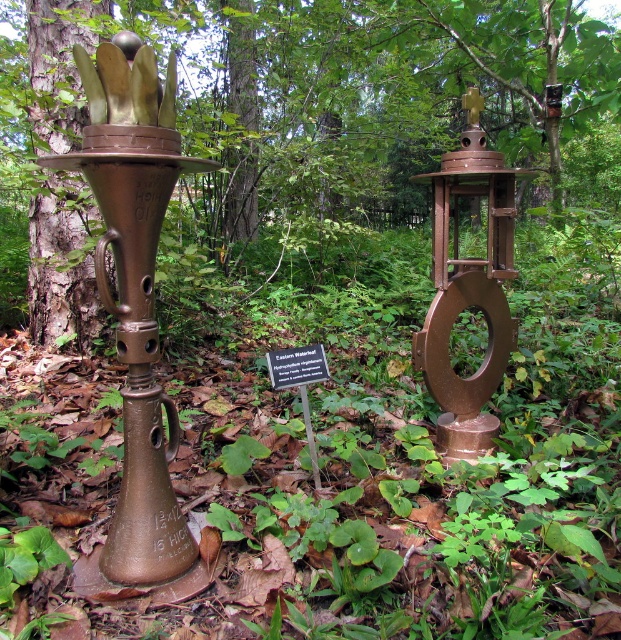
Question: Among these points, which one is nearest to the camera?

Choices:
 (A) (109, 324)
 (B) (152, 218)

Answer: (B)

Question: Does brushed metal tree at center appear under bronze/metallic torch at center?

Choices:
 (A) yes
 (B) no

Answer: (B)

Question: Is brushed metal tree at center to the right of bronze/metallic torch at center from the viewer's perspective?

Choices:
 (A) no
 (B) yes

Answer: (B)

Question: Is brushed metal tree at center to the left of bronze/metallic torch at center from the viewer's perspective?

Choices:
 (A) no
 (B) yes

Answer: (A)